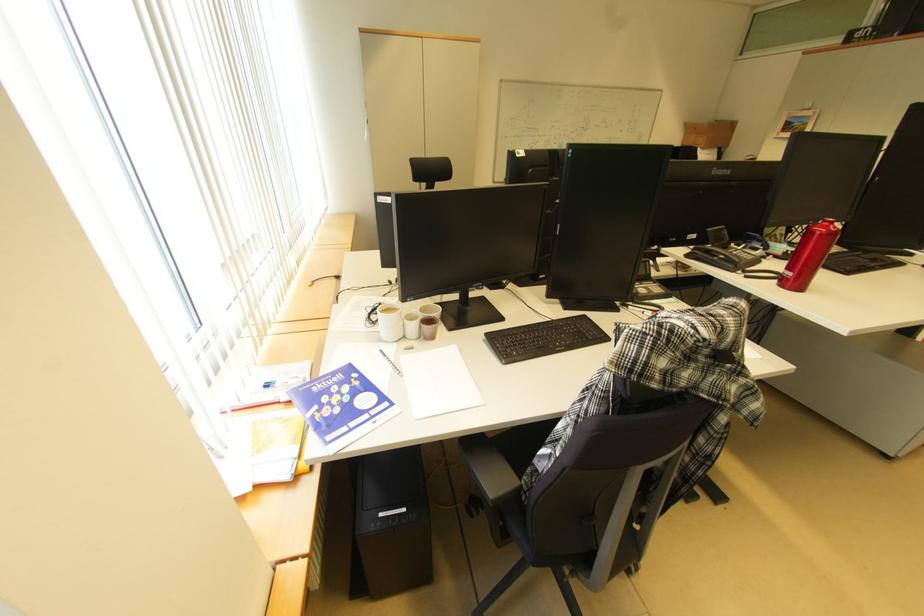
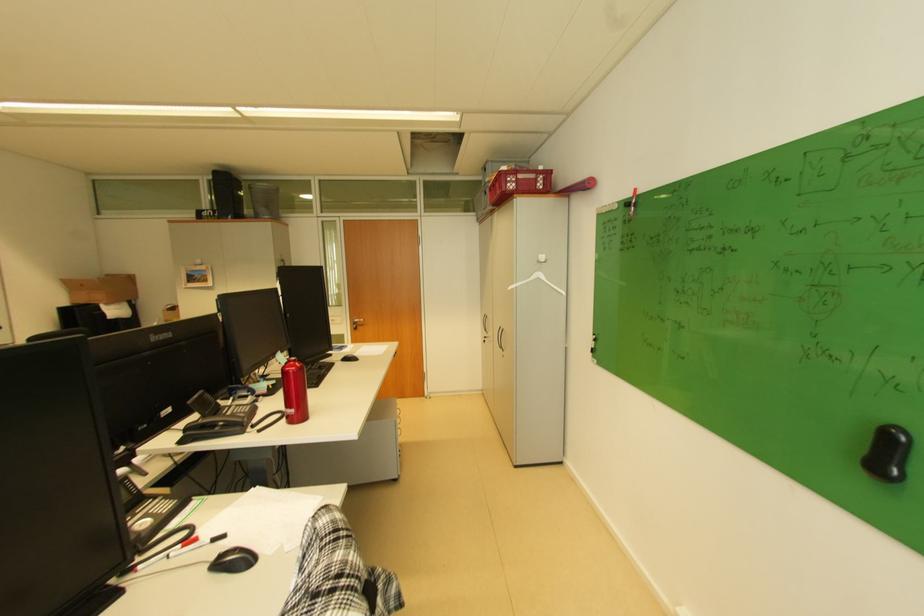
Locate, in the second image, the point that corresponds to (x=730, y=257) in the first image.

(229, 424)